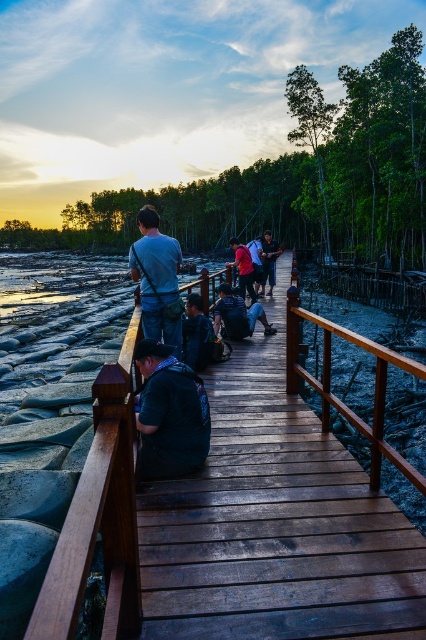
Question: Can you confirm if matte blue shirt at center is smaller than matte black backpack at center?

Choices:
 (A) no
 (B) yes

Answer: (B)

Question: Does matte blue shirt at center have a larger size compared to matte black backpack at center?

Choices:
 (A) no
 (B) yes

Answer: (A)

Question: Which object appears farthest from the camera in this image?

Choices:
 (A) matte red shirt at center
 (B) matte black backpack at center
 (C) matte blue shirt at center

Answer: (B)

Question: Among these objects, which one is farthest from the camera?

Choices:
 (A) matte red shirt at center
 (B) brown wooden bridge at center
 (C) dark blue fabric shirt at center
 (D) matte blue shirt at center

Answer: (A)

Question: Among these points, which one is farthest from the camera?

Choices:
 (A) (264, 291)
 (B) (140, 280)

Answer: (A)

Question: Is dark blue fabric shirt at center behind matte red shirt at center?

Choices:
 (A) no
 (B) yes

Answer: (A)